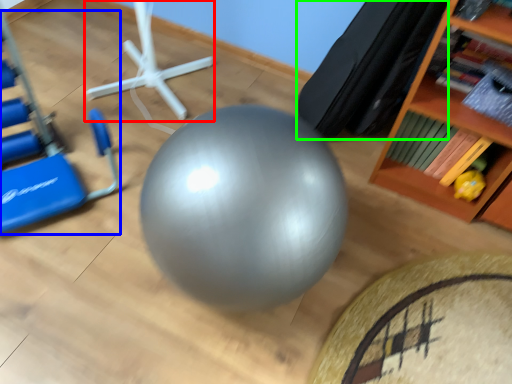
Question: Which object is positioned farthest from sport equipment (highlighted by a red box)? Select from swivel chair (highlighted by a blue box) and bean bag chair (highlighted by a green box).

Choices:
 (A) swivel chair
 (B) bean bag chair

Answer: (B)